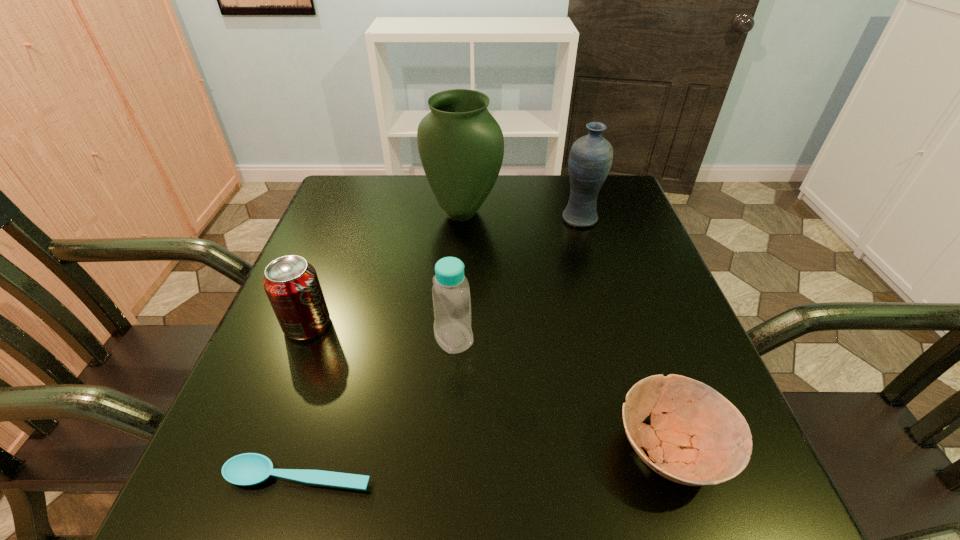
The height and width of the screenshot is (540, 960). Find the location of `free space located on the left of the fourth shortest object`. free space located on the left of the fourth shortest object is located at coordinates (327, 338).

This screenshot has width=960, height=540. I want to click on blank space located 0.360m on the right of the fourth tallest object, so click(516, 325).

In order to click on free spot located 0.330m on the back of the bowl in this screenshot , I will do `click(611, 270)`.

At what (x,y) coordinates should I click in order to perform the action: click on free spot located 0.210m on the right of the spoon. Please return your answer as a coordinate pair (x, y). Looking at the image, I should click on (516, 476).

Image resolution: width=960 pixels, height=540 pixels. Identify the location of bowl that is positioned at the near edge. (703, 439).

Image resolution: width=960 pixels, height=540 pixels. In order to click on spoon located in the near edge section of the desktop in this screenshot , I will do `click(247, 469)`.

Find the location of a particular element. The image size is (960, 540). soda can at the left edge is located at coordinates (292, 286).

Locate an element on the screen. spoon present at the left edge is located at coordinates (247, 469).

Locate an element on the screen. The height and width of the screenshot is (540, 960). vase located in the right edge section of the desktop is located at coordinates (590, 159).

Identify the location of bowl that is at the right edge. Image resolution: width=960 pixels, height=540 pixels. (703, 439).